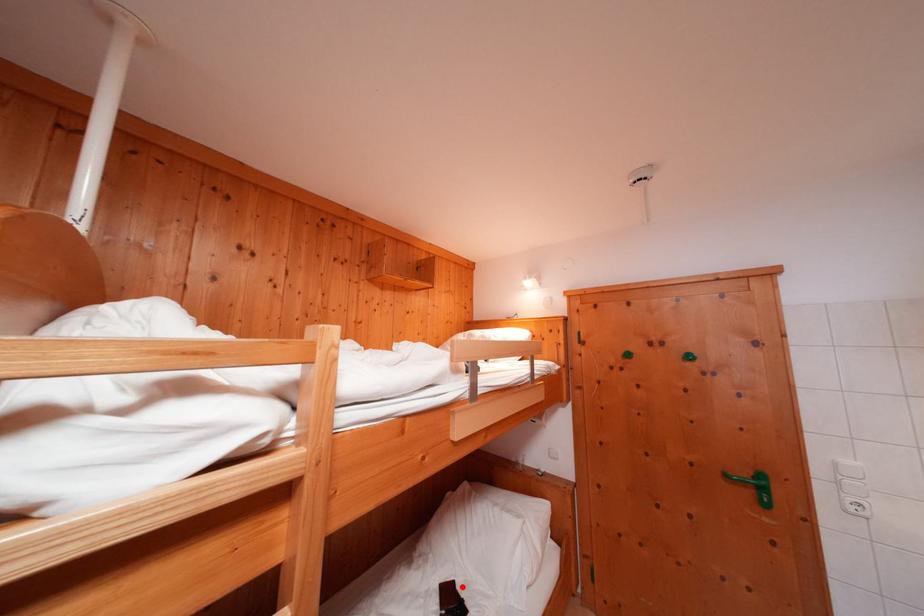
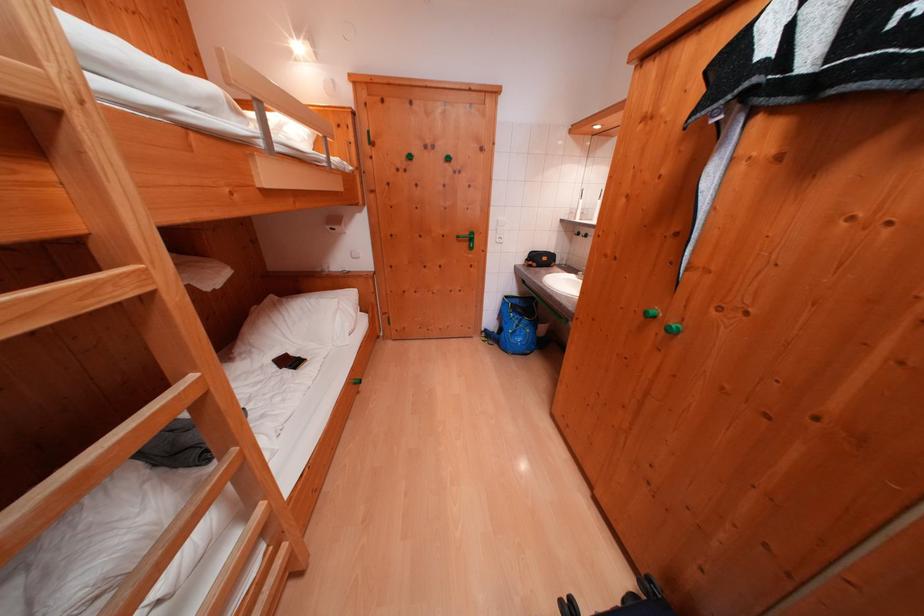
Find the pixel in the second image that matches the highlighted location in the first image.

(295, 359)